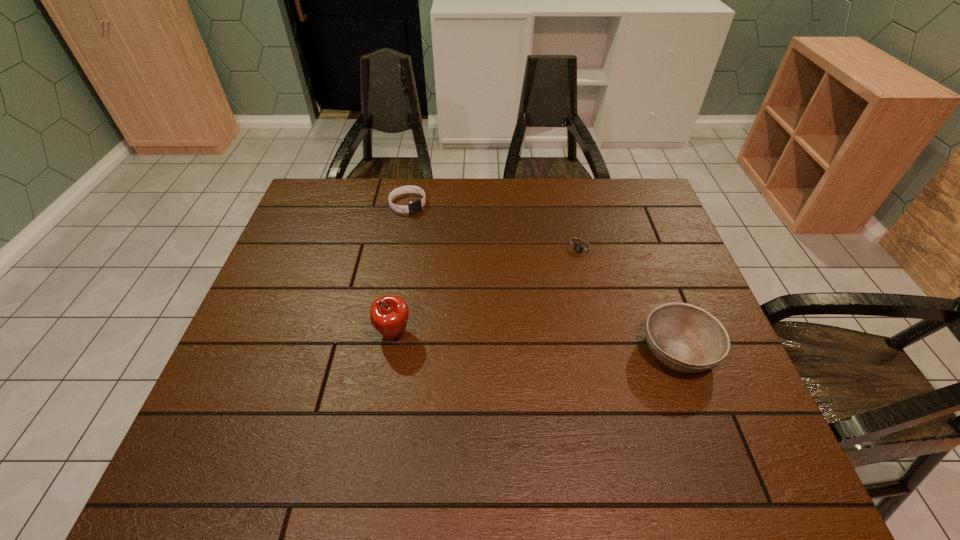
The width and height of the screenshot is (960, 540). I want to click on vacant space on the desktop that is between the tallest object and the third shortest object and is positioned on the face of the watch, so click(x=507, y=341).

This screenshot has height=540, width=960. Identify the location of vacant space on the desktop that is between the tallest object and the second tallest object and is positioned on the outer surface of the farthest object. 551,343.